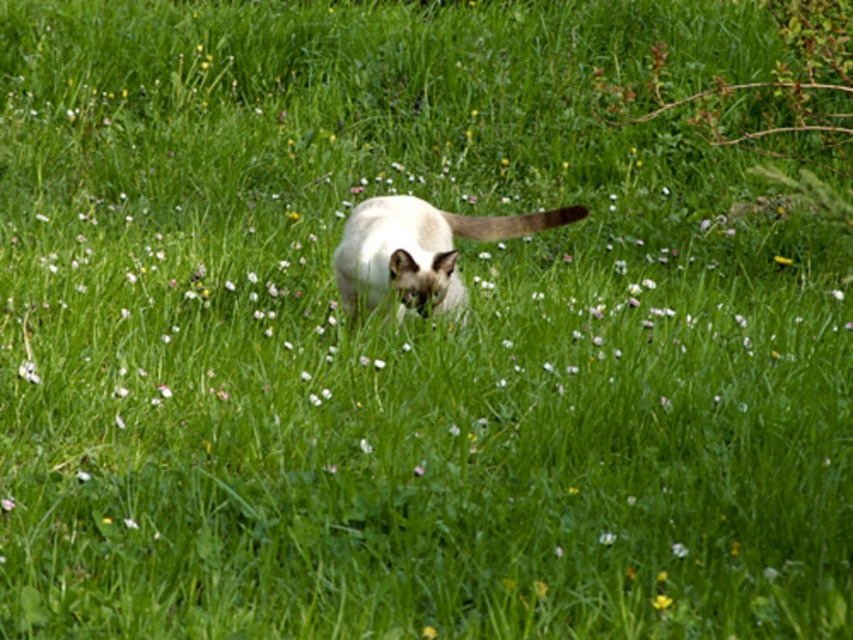
Question: Among these objects, which one is farthest from the camera?

Choices:
 (A) white fur cat at center
 (B) yellow matte flower at lower right

Answer: (A)

Question: Can you confirm if white fur cat at center is smaller than yellow matte flower at lower right?

Choices:
 (A) no
 (B) yes

Answer: (A)

Question: Does white fur cat at center have a larger size compared to yellow matte flower at lower right?

Choices:
 (A) yes
 (B) no

Answer: (A)

Question: Which object appears farthest from the camera in this image?

Choices:
 (A) yellow matte flower at lower right
 (B) white fur cat at center

Answer: (B)

Question: Does white fur cat at center have a smaller size compared to yellow matte flower at lower right?

Choices:
 (A) yes
 (B) no

Answer: (B)